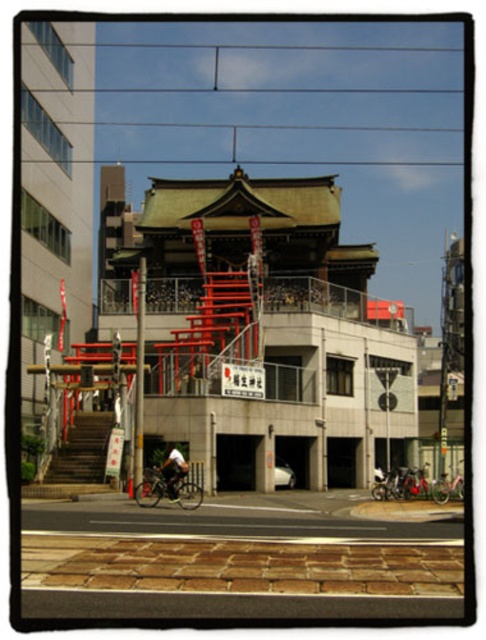
Can you confirm if silver metallic bicycle at center is bigger than white fabric shirt at center?

Indeed, silver metallic bicycle at center has a larger size compared to white fabric shirt at center.

Who is shorter, silver metallic bicycle at center or white fabric shirt at center?

white fabric shirt at center is shorter.

You are a GUI agent. You are given a task and a screenshot of the screen. Output one action in this format:
    pyautogui.click(x=<x>, y=<y>)
    Task: Click on the silver metallic bicycle at center
    The height and width of the screenshot is (640, 486).
    Given the screenshot: What is the action you would take?
    pyautogui.click(x=168, y=486)

Where is `silver metallic bicycle at center`? The height and width of the screenshot is (640, 486). silver metallic bicycle at center is located at coordinates (168, 486).

Who is more distant from viewer, (x=180, y=458) or (x=404, y=477)?

Point (x=404, y=477)

Locate an element on the screen. The width and height of the screenshot is (486, 640). white fabric shirt at center is located at coordinates (173, 472).

Find the location of a particular element. This screenshot has width=486, height=640. white fabric shirt at center is located at coordinates (173, 472).

Is shiny metallic bicycle at center thinner than metallic silver bicycle at lower right?

Indeed, shiny metallic bicycle at center has a lesser width compared to metallic silver bicycle at lower right.

This screenshot has height=640, width=486. Describe the element at coordinates (414, 483) in the screenshot. I see `shiny metallic bicycle at center` at that location.

Which is in front, point (415, 477) or point (447, 490)?

Point (447, 490) is more forward.

I want to click on shiny metallic bicycle at center, so click(x=414, y=483).